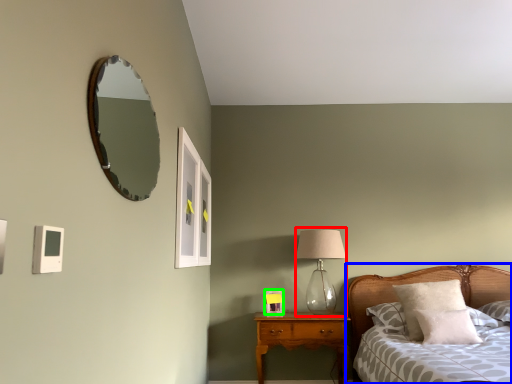
Question: Considering the real-world distances, which object is closest to table lamp (highlighted by a red box)? bed (highlighted by a blue box) or picture frame (highlighted by a green box).

Choices:
 (A) bed
 (B) picture frame

Answer: (B)